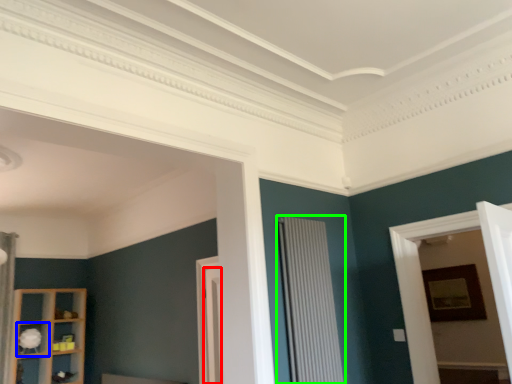
Question: Based on their relative distances, which object is farther from door (highlighted by a red box)? Choose from shelf (highlighted by a blue box) and radiator (highlighted by a green box).

Choices:
 (A) shelf
 (B) radiator

Answer: (A)